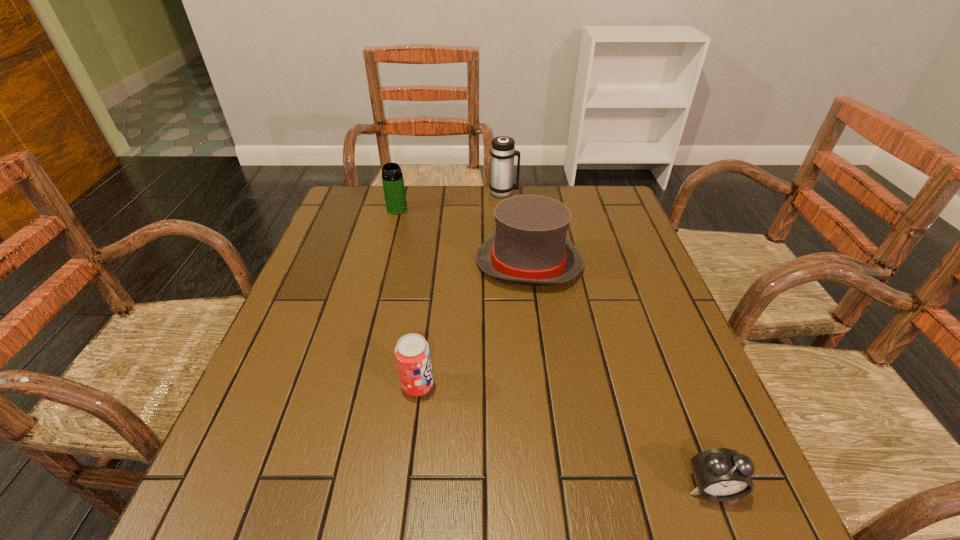
You are a GUI agent. You are given a task and a screenshot of the screen. Output one action in this format:
    pyautogui.click(x=<x>, y=<y>)
    Task: Click on the right thermos bottle
    The height and width of the screenshot is (540, 960).
    Given the screenshot: What is the action you would take?
    pyautogui.click(x=502, y=151)

The width and height of the screenshot is (960, 540). Find the location of `the farther thermos bottle`. the farther thermos bottle is located at coordinates (502, 151).

Locate an element on the screen. This screenshot has width=960, height=540. the left thermos bottle is located at coordinates (393, 184).

The width and height of the screenshot is (960, 540). I want to click on the nearer thermos bottle, so click(x=393, y=184).

In order to click on dress hat in this screenshot , I will do `click(530, 246)`.

Identify the location of the second nearest object. The image size is (960, 540). (412, 353).

You are a GUI agent. You are given a task and a screenshot of the screen. Output one action in this format:
    pyautogui.click(x=<x>, y=<y>)
    Task: Click on the second object from left to right
    This screenshot has width=960, height=540.
    Given the screenshot: What is the action you would take?
    pyautogui.click(x=412, y=353)

Find the location of a particular element. This screenshot has width=960, height=540. the nearest object is located at coordinates (721, 474).

I want to click on the shortest object, so click(x=721, y=474).

This screenshot has width=960, height=540. In order to click on free space located on the side with the handle of the farther thermos bottle in this screenshot , I will do `click(564, 193)`.